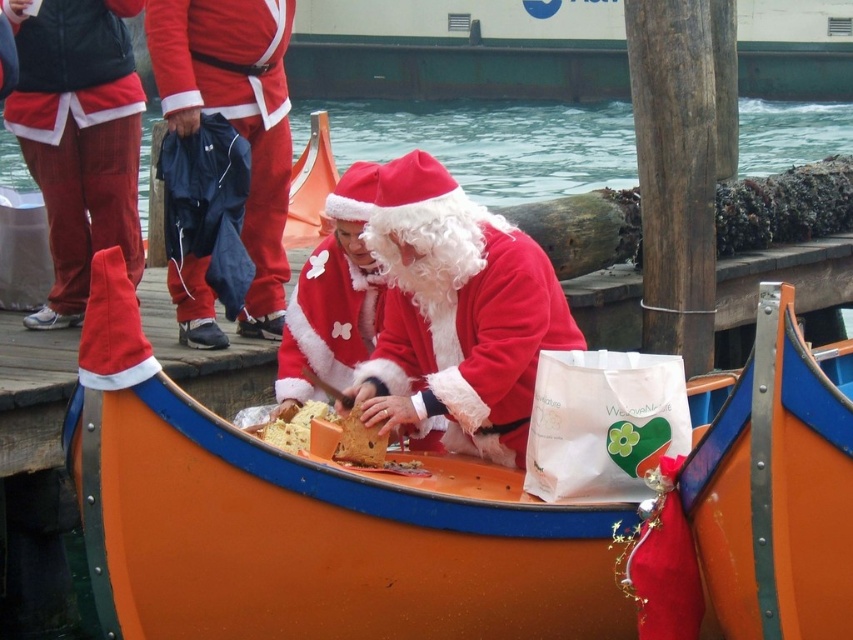
You are a photographer taking a picture of the festive scene. You notice two points marked in the image at coordinates point (x=195, y=97) and point (x=302, y=422). Which point is closer to your camera lens?

Point (x=195, y=97) is further to the camera than point (x=302, y=422), so the point closer to the camera lens is point (x=195, y=97).

You are taking a photo of the festive scene and want to focus on both the point at (x=111, y=131) and the point at (x=227, y=38). Which point should you focus on first to ensure both are in clear view?

You should focus on point (x=111, y=131) first because it is closer to the camera than point (x=227, y=38). This ensures that both points will be in focus when using a depth of field that extends from the closer point to the farther one.